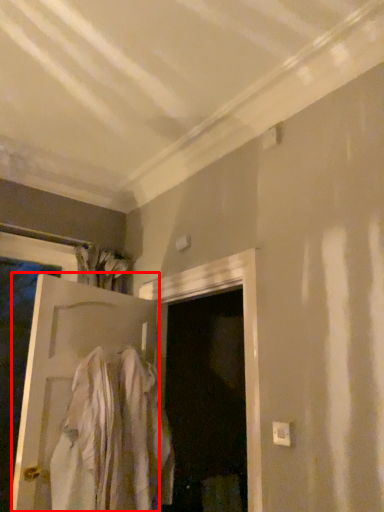
Question: From the image's perspective, what is the correct spatial relationship of door (annotated by the red box) in relation to clothing?

Choices:
 (A) above
 (B) below

Answer: (A)